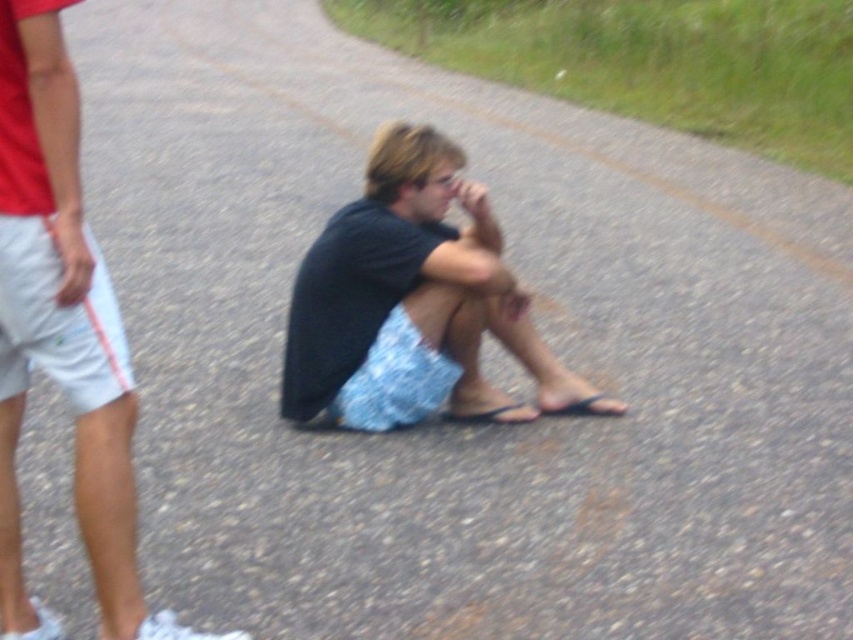
You are standing on the paved path and see the matte black shirt at center and the dark gray fabric shorts at center. Which one is positioned more to the left?

The matte black shirt at center is positioned to the left of the dark gray fabric shorts at center, so the matte black shirt at center is more to the left.

You are standing at the point with coordinates point (86, 349) and want to walk towards the point with coordinates point (299, 390). Which direction should you face to walk directly towards it?

Since point (86, 349) is in front of point (299, 390), you should face backward to walk directly towards it.